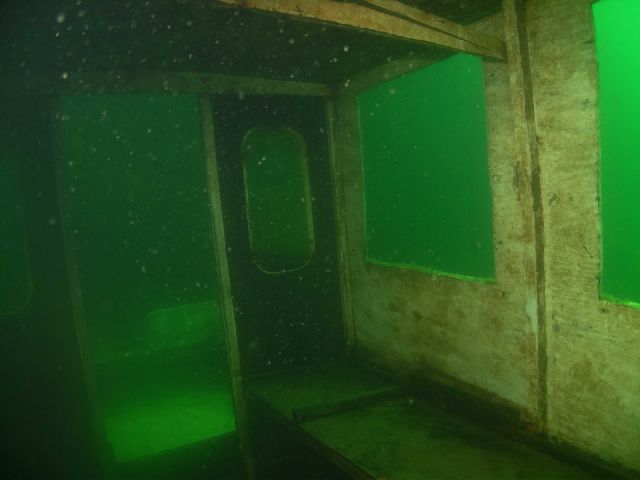
In order to click on window corners in this screenshot , I will do `click(495, 283)`, `click(365, 259)`, `click(355, 91)`, `click(598, 297)`, `click(589, 5)`.